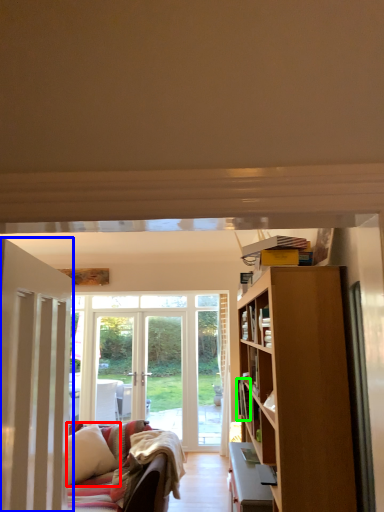
Question: Considering the real-world distances, which object is farthest from pillow (highlighted by a red box)? door (highlighted by a blue box) or book (highlighted by a green box)?

Choices:
 (A) door
 (B) book

Answer: (A)